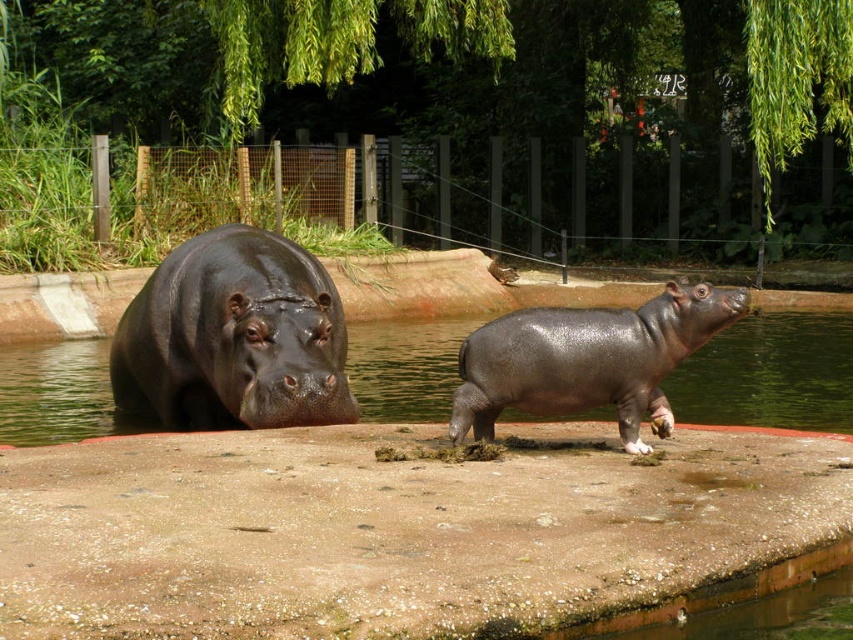
Question: Which object is closer to the camera taking this photo?

Choices:
 (A) shiny dark brown hippo at left
 (B) glossy water at hippo right
 (C) shiny dark gray hippo at center

Answer: (C)

Question: Is the position of shiny dark brown hippo at left less distant than that of glossy water at hippo right?

Choices:
 (A) yes
 (B) no

Answer: (A)

Question: Does shiny dark brown hippo at left come behind shiny dark gray hippo at center?

Choices:
 (A) yes
 (B) no

Answer: (A)

Question: Estimate the real-world distances between objects in this image. Which object is farther from the shiny dark gray hippo at center?

Choices:
 (A) shiny dark brown hippo at left
 (B) glossy water at hippo right

Answer: (B)

Question: Is shiny dark brown hippo at left positioned before glossy water at hippo right?

Choices:
 (A) no
 (B) yes

Answer: (B)

Question: Based on their relative distances, which object is farther from the shiny dark gray hippo at center?

Choices:
 (A) glossy water at hippo right
 (B) shiny dark brown hippo at left

Answer: (A)